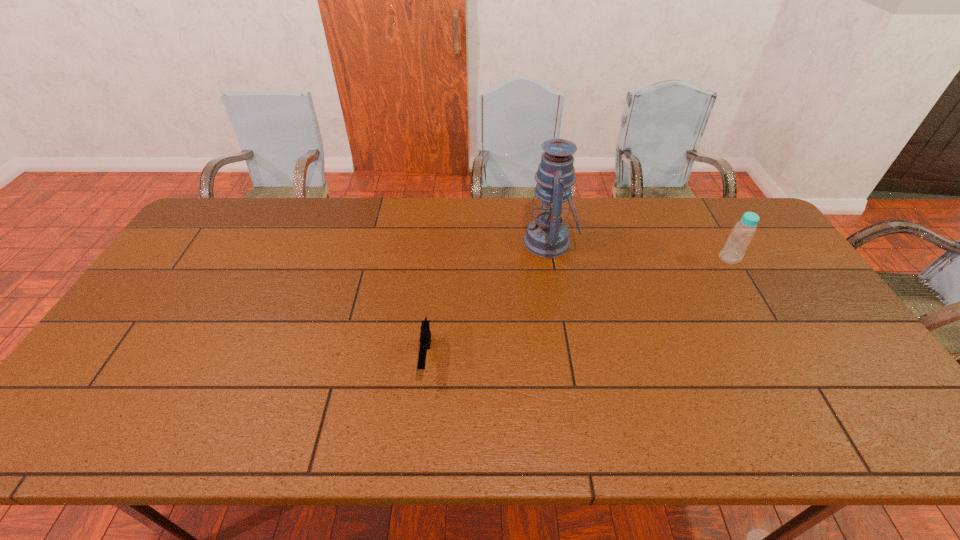
The height and width of the screenshot is (540, 960). Identify the location of free location that satisfies the following two spatial constraints: 1. on the front-facing side of the second shortest object; 2. on the left side of the lantern. (552, 258).

Where is `vacant space that satisfies the following two spatial constraints: 1. on the front-facing side of the bottle; 2. on the left side of the tallest object`? Image resolution: width=960 pixels, height=540 pixels. vacant space that satisfies the following two spatial constraints: 1. on the front-facing side of the bottle; 2. on the left side of the tallest object is located at coordinates (552, 258).

At what (x,y) coordinates should I click in order to perform the action: click on free spot that satisfies the following two spatial constraints: 1. on the front-facing side of the tallest object; 2. on the right side of the rightmost object. Please return your answer as a coordinate pair (x, y). The height and width of the screenshot is (540, 960). Looking at the image, I should click on (552, 258).

The image size is (960, 540). Identify the location of free spot that satisfies the following two spatial constraints: 1. on the front-facing side of the lantern; 2. on the front-facing side of the leftmost object. coord(569,358).

Find the location of a particular element. Image resolution: width=960 pixels, height=540 pixels. free location that satisfies the following two spatial constraints: 1. on the front-facing side of the tallest object; 2. on the front-facing side of the pistol is located at coordinates (569, 358).

The image size is (960, 540). Find the location of `vacant space that satisfies the following two spatial constraints: 1. on the front-facing side of the tallest object; 2. on the back side of the bottle`. vacant space that satisfies the following two spatial constraints: 1. on the front-facing side of the tallest object; 2. on the back side of the bottle is located at coordinates (552, 258).

Identify the location of vacant position in the image that satisfies the following two spatial constraints: 1. on the front-facing side of the tallest object; 2. on the front-facing side of the shortest object. (569, 358).

Identify the location of vacant space that satisfies the following two spatial constraints: 1. on the front-facing side of the second object from left to right; 2. on the front-facing side of the shortest object. Image resolution: width=960 pixels, height=540 pixels. click(569, 358).

Where is `vacant region that satisfies the following two spatial constraints: 1. on the front-facing side of the bottle; 2. on the right side of the tallest object`? The width and height of the screenshot is (960, 540). vacant region that satisfies the following two spatial constraints: 1. on the front-facing side of the bottle; 2. on the right side of the tallest object is located at coordinates (552, 258).

You are a GUI agent. You are given a task and a screenshot of the screen. Output one action in this format:
    pyautogui.click(x=<x>, y=<y>)
    Task: Click on the free spot that satisfies the following two spatial constraints: 1. on the front-facing side of the tallest object; 2. on the front-facing side of the shortest object
    
    Given the screenshot: What is the action you would take?
    pyautogui.click(x=569, y=358)